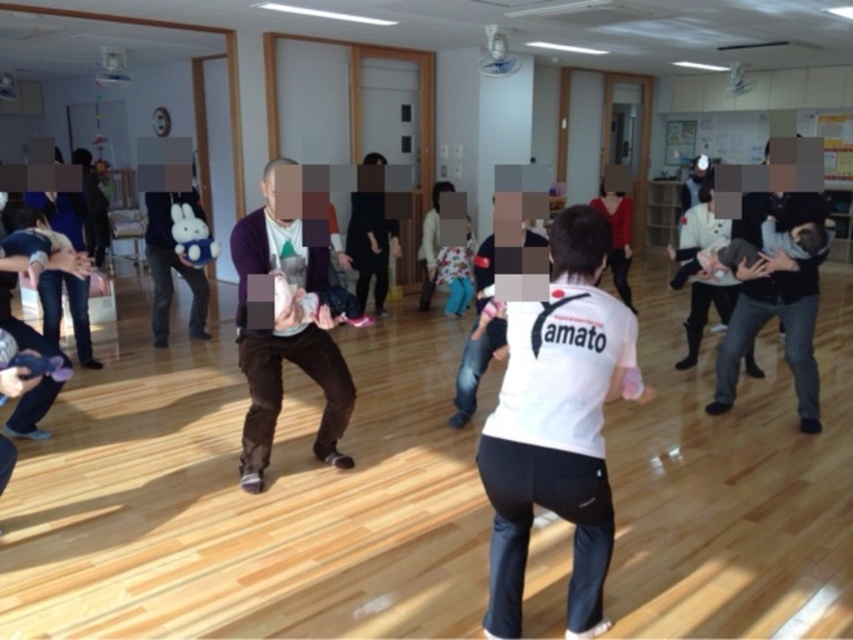
Is point (515, 550) closer to viewer compared to point (265, 243)?

Yes, it is in front of point (265, 243).

Does point (511, 416) come behind point (329, 458)?

No, (511, 416) is closer to viewer.

You are a GUI agent. You are given a task and a screenshot of the screen. Output one action in this format:
    pyautogui.click(x=<x>, y=<y>)
    Task: Click on the white matte shirt at center
    This screenshot has height=640, width=853.
    Given the screenshot: What is the action you would take?
    pyautogui.click(x=556, y=424)